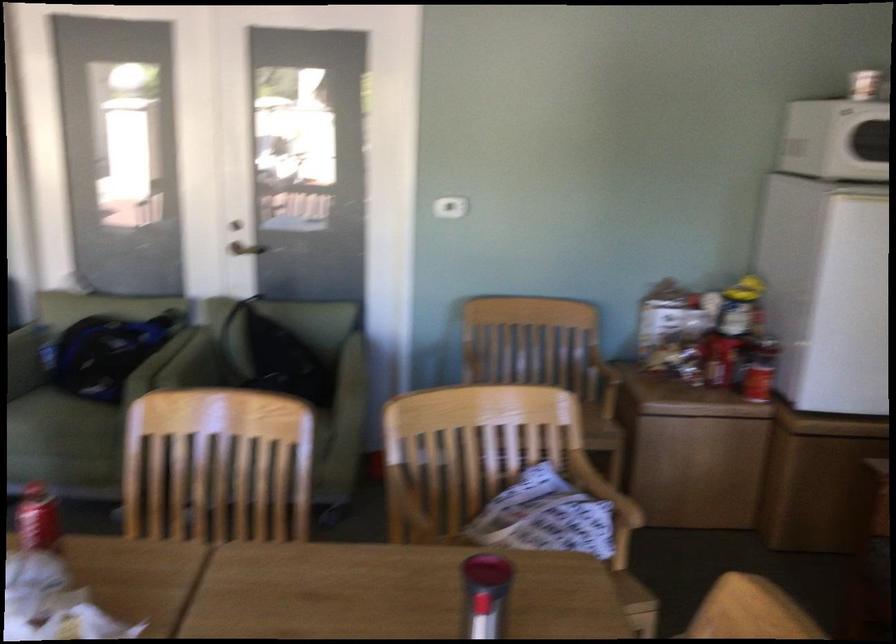
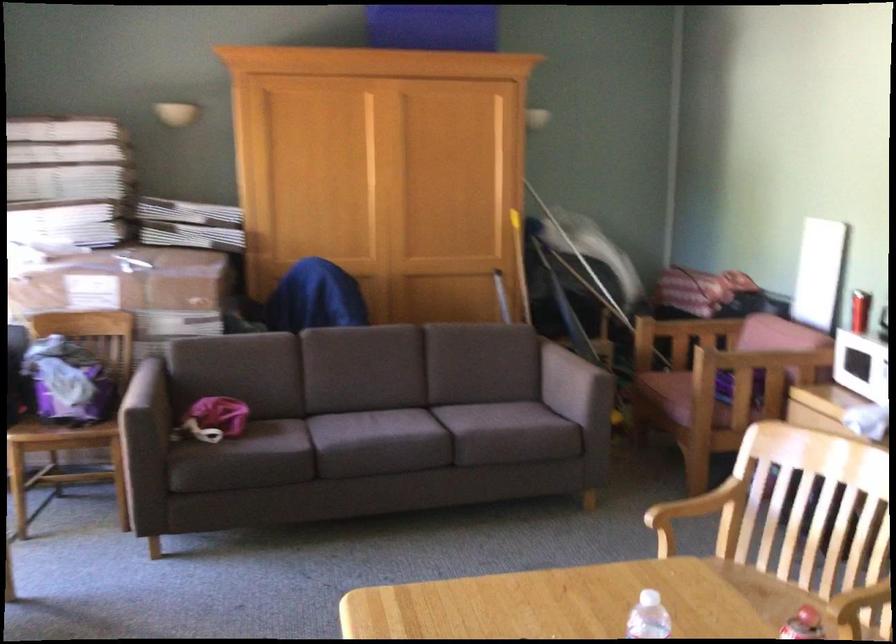
Question: The camera is either moving clockwise (left) or counter-clockwise (right) around the object. The first image is from the beginning of the video and the second image is from the end. Is the camera moving left or right when shooting the video?

Choices:
 (A) Left
 (B) Right

Answer: (B)